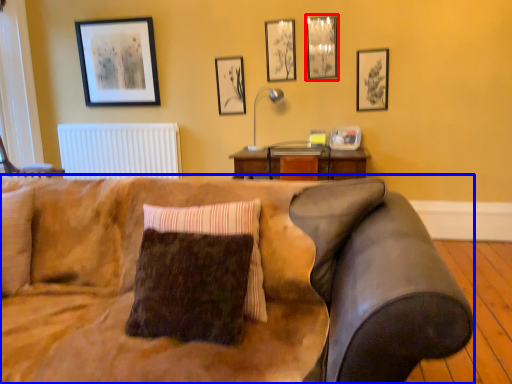
Question: Which object is closer to the camera taking this photo, picture frame (highlighted by a red box) or studio couch (highlighted by a blue box)?

Choices:
 (A) picture frame
 (B) studio couch

Answer: (B)